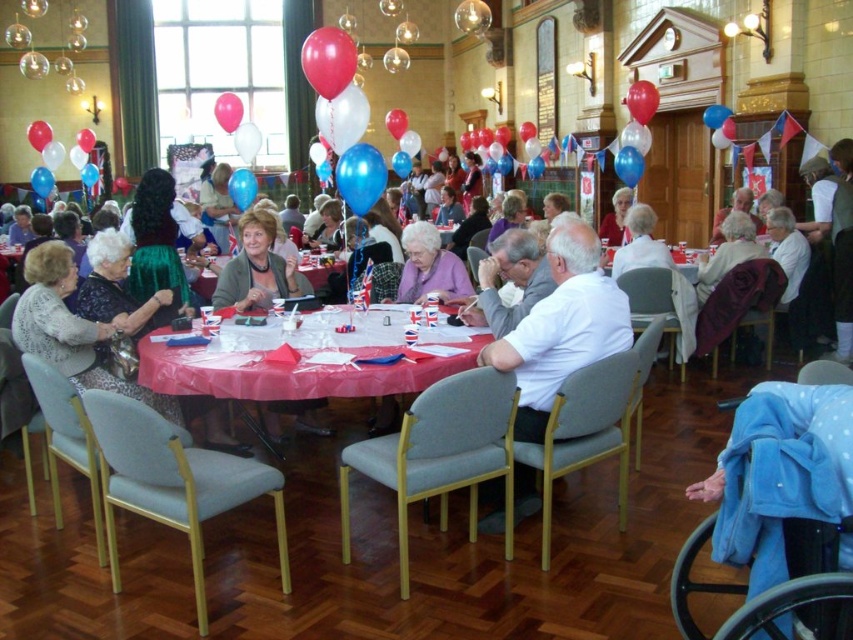
From the picture: You are organizing a photo shoot and need to ensure that both the matte gray sweater at center and the blue rubber balloon at center are visible in the frame. Given their sizes, which object should you focus on to ensure both are in the shot without cropping?

The matte gray sweater at center is taller than the blue rubber balloon at center, so focusing on the taller object will ensure both are visible in the frame.

You are organizing a photo shoot and need to ensure that the matte gray sweater at center and the blue rubber balloon at center are both visible in the frame. Given that the camera has a fixed focal length, which object should you prioritize positioning closer to the camera to ensure clarity and detail?

The matte gray sweater at center has a larger width than the blue rubber balloon at center, so you should prioritize positioning the blue rubber balloon at center closer to the camera to ensure both objects are clearly visible in the frame.

You are organizing a photo shoot and need to ensure that the white shirt at center and the white fabric chair at center are both visible in the frame. Given that the camera has a maximum width capacity of 1 meter, can both items fit side by side without overlapping?

The white shirt at center is narrower than the white fabric chair at center. Since the camera can capture up to 1 meter, and the combined width of both items would depend on their individual measurements, but since the shirt is narrower, it is likely they can fit side by side within the 1 meter limit if positioned properly.